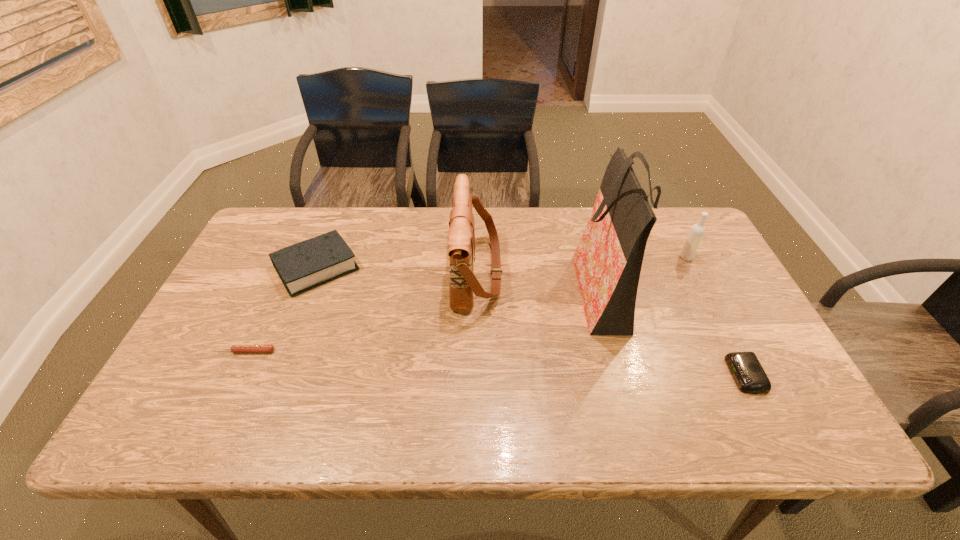
Locate an element on the screen. This screenshot has height=540, width=960. blank space at the far edge of the desktop is located at coordinates (491, 247).

In the image, there is a desktop. Where is `blank space at the near edge`? The image size is (960, 540). blank space at the near edge is located at coordinates (436, 406).

In the image, there is a desktop. Where is `vacant space at the left edge`? vacant space at the left edge is located at coordinates (176, 394).

The height and width of the screenshot is (540, 960). I want to click on blank space at the right edge of the desktop, so pyautogui.click(x=741, y=301).

In the image, there is a desktop. What are the coordinates of `free space at the far left corner` in the screenshot? It's located at (266, 241).

In the image, there is a desktop. In order to click on free space at the near left corner in this screenshot , I will do `click(188, 407)`.

Identify the location of vacant space at the far right corner. Image resolution: width=960 pixels, height=540 pixels. (683, 232).

In the image, there is a desktop. Identify the location of vacant space at the near right corner. The height and width of the screenshot is (540, 960). (748, 437).

Find the location of `free space between the fourth tallest object and the alarm clock`. free space between the fourth tallest object and the alarm clock is located at coordinates (531, 321).

You are a GUI agent. You are given a task and a screenshot of the screen. Output one action in this format:
    pyautogui.click(x=<x>, y=<y>)
    Task: Click on the free area in between the fourth tallest object and the nearest object
    
    Given the screenshot: What is the action you would take?
    pyautogui.click(x=531, y=321)